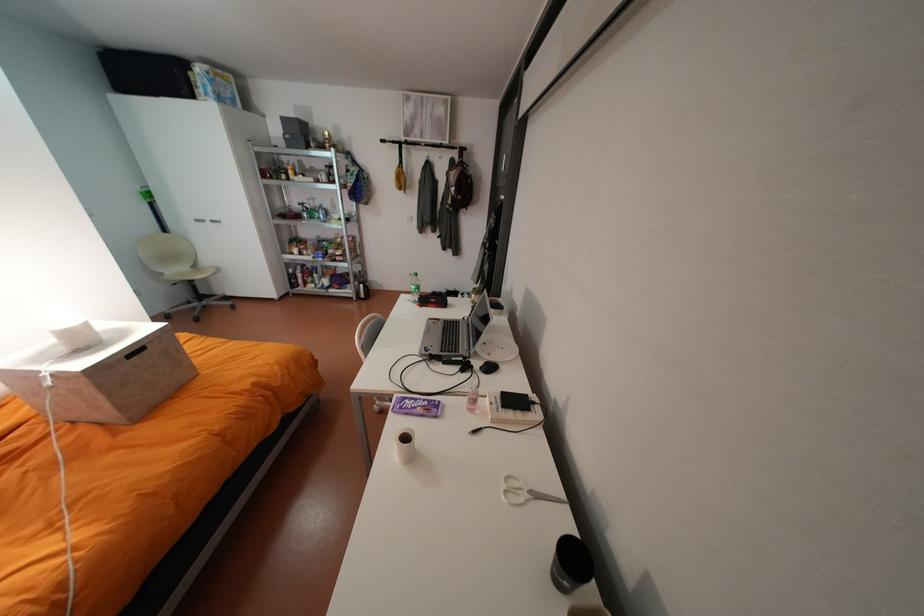
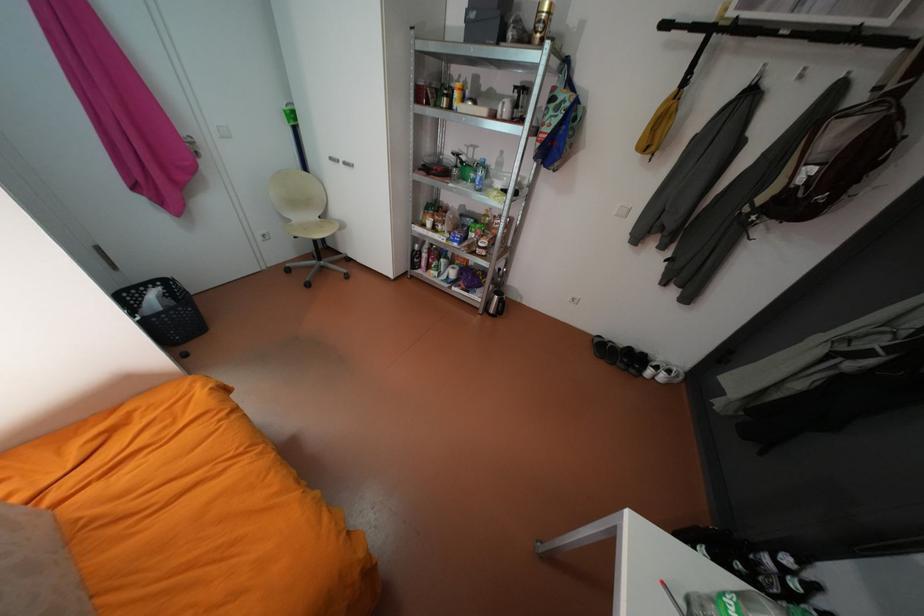
Find the pixel in the second image that matches the point at 331,146 in the first image.

(533, 39)